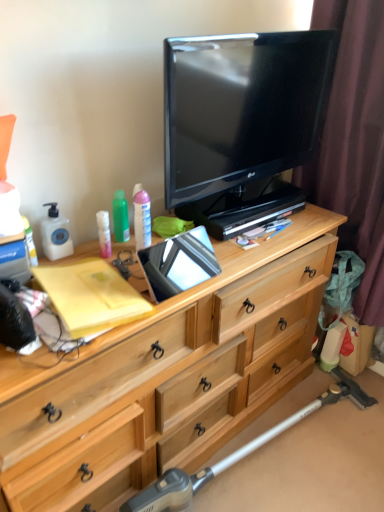
Question: Does matte plastic lotion at center, which is counted as the 1th toiletry, starting from the right, come behind metallic silver vacuum cleaner at lower right?

Choices:
 (A) yes
 (B) no

Answer: (A)

Question: Is matte plastic lotion at center, which is counted as the 1th toiletry, starting from the right, wider than metallic silver vacuum cleaner at lower right?

Choices:
 (A) no
 (B) yes

Answer: (A)

Question: From a real-world perspective, is matte plastic lotion at center, which is counted as the 1th toiletry, starting from the right, beneath metallic silver vacuum cleaner at lower right?

Choices:
 (A) yes
 (B) no

Answer: (B)

Question: Is matte plastic lotion at center, the third toiletry viewed from the left, at the left side of metallic silver vacuum cleaner at lower right?

Choices:
 (A) no
 (B) yes

Answer: (B)

Question: From the image's perspective, is matte plastic lotion at center, which is counted as the 1th toiletry, starting from the right, located above metallic silver vacuum cleaner at lower right?

Choices:
 (A) yes
 (B) no

Answer: (A)

Question: Which is correct: light wood dresser at center is inside brown fabric curtain at right, or outside of it?

Choices:
 (A) inside
 (B) outside

Answer: (B)

Question: In terms of width, does light wood dresser at center look wider or thinner when compared to brown fabric curtain at right?

Choices:
 (A) wide
 (B) thin

Answer: (A)

Question: In the image, is light wood dresser at center positioned in front of or behind brown fabric curtain at right?

Choices:
 (A) behind
 (B) front

Answer: (B)

Question: Does point (140, 354) appear closer or farther from the camera than point (375, 152)?

Choices:
 (A) farther
 (B) closer

Answer: (B)

Question: In terms of width, does matte plastic lotion at left, which is counted as the 1th toiletry, starting from the left, look wider or thinner when compared to green plastic bottle at upper left, marked as the second toiletry in a right-to-left arrangement?

Choices:
 (A) wide
 (B) thin

Answer: (B)

Question: In terms of size, does matte plastic lotion at left, which is counted as the 1th toiletry, starting from the left, appear bigger or smaller than green plastic bottle at upper left, marked as the second toiletry in a right-to-left arrangement?

Choices:
 (A) small
 (B) big

Answer: (A)

Question: Is matte plastic lotion at left, which is counted as the 1th toiletry, starting from the left, to the left or to the right of green plastic bottle at upper left, marked as the second toiletry in a right-to-left arrangement, in the image?

Choices:
 (A) right
 (B) left

Answer: (B)

Question: From the image's perspective, is matte plastic lotion at left, arranged as the third toiletry when viewed from the right, positioned above or below green plastic bottle at upper left, which appears as the 2th toiletry when viewed from the left?

Choices:
 (A) above
 (B) below

Answer: (B)

Question: Does point (132, 196) appear closer or farther from the camera than point (115, 207)?

Choices:
 (A) closer
 (B) farther

Answer: (A)

Question: Visually, is matte plastic lotion at center, the third toiletry viewed from the left, positioned to the left or to the right of green plastic bottle at upper left, marked as the second toiletry in a right-to-left arrangement?

Choices:
 (A) left
 (B) right

Answer: (B)